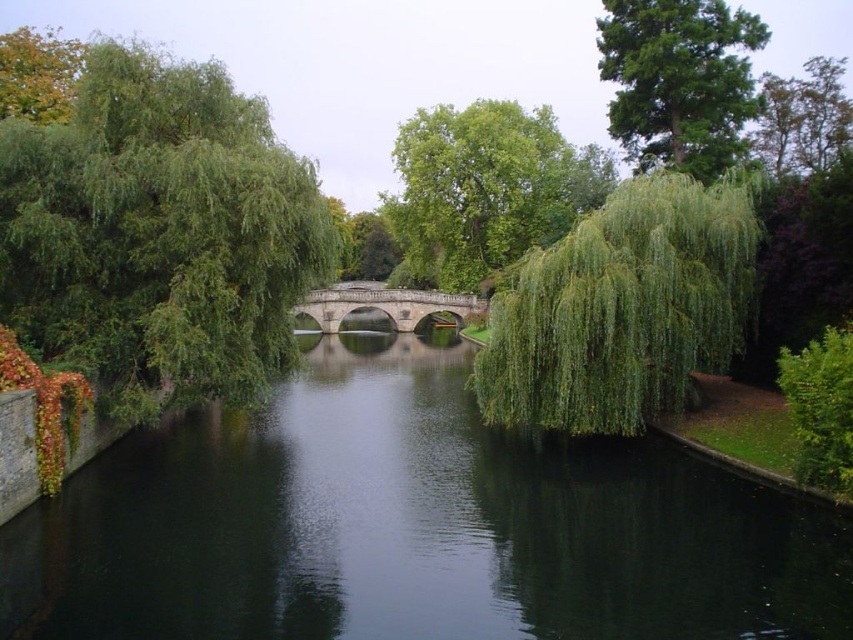
Is green leafy tree at center bigger than green leafy tree at upper left?

Actually, green leafy tree at center might be smaller than green leafy tree at upper left.

Who is positioned more to the left, green leafy tree at center or green leafy tree at upper left?

green leafy tree at upper left

The image size is (853, 640). What are the coordinates of `green leafy tree at center` in the screenshot? It's located at (485, 189).

Can you confirm if green leafy willow at center is shorter than green leafy tree at upper right?

Yes, green leafy willow at center is shorter than green leafy tree at upper right.

Which is below, green leafy willow at center or green leafy tree at upper right?

green leafy willow at center is lower down.

This screenshot has width=853, height=640. Describe the element at coordinates (624, 308) in the screenshot. I see `green leafy willow at center` at that location.

Identify the location of green leafy willow at center. (624, 308).

Can you confirm if green leafy tree at left is taller than green leafy tree at upper right?

No, green leafy tree at left is not taller than green leafy tree at upper right.

Is point (74, 96) behind point (764, 28)?

That is False.

In the scene shown: Who is more forward, (136, 406) or (701, 0)?

Point (136, 406) is in front.

The width and height of the screenshot is (853, 640). I want to click on green leafy tree at left, so click(158, 230).